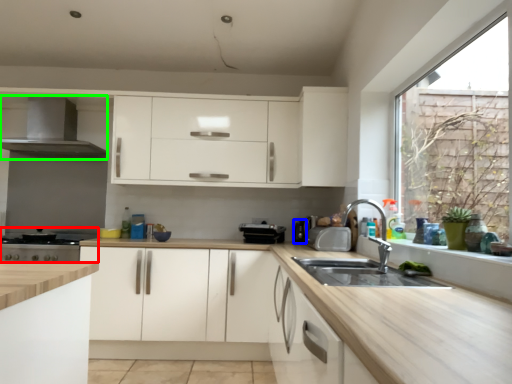
Question: Estimate the real-world distances between objects in this image. Which object is farther from appliance (highlighted by a red box), appliance (highlighted by a blue box) or exhaust hood (highlighted by a green box)?

Choices:
 (A) appliance
 (B) exhaust hood

Answer: (A)